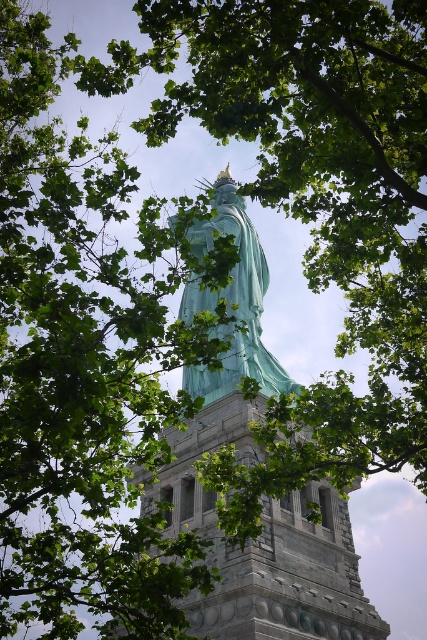
Is green stone tower at center positioned in front of green patina statue at center?

Yes, green stone tower at center is in front of green patina statue at center.

Is point (210, 620) farther from viewer compared to point (186, 374)?

No.

Between point (219, 630) and point (202, 252), which one is positioned in front?

Positioned in front is point (219, 630).

Where is `green stone tower at center`? green stone tower at center is located at coordinates (263, 545).